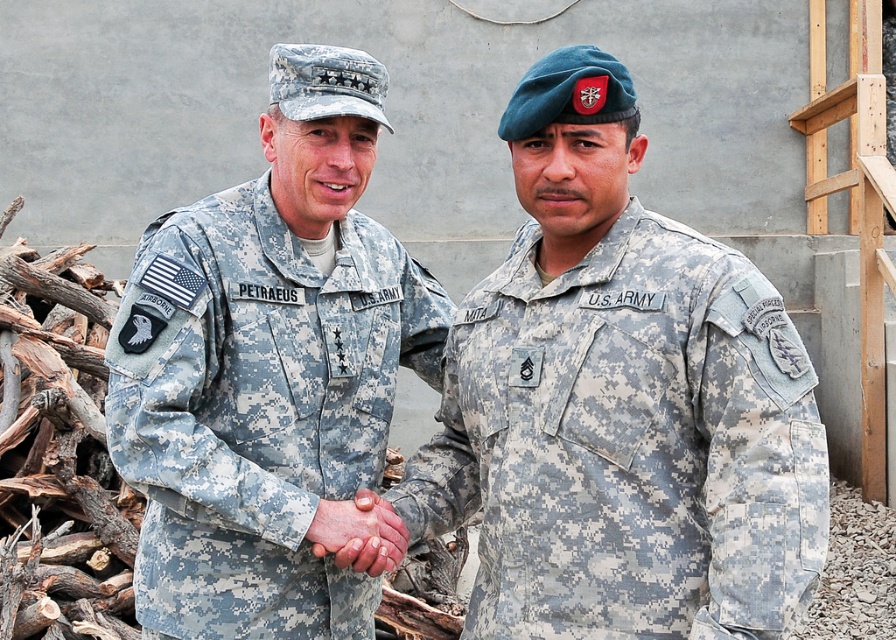
You are a photographer taking a picture of the scene. You want to focus on the point closer to the camera. Which point should you choose between point [610,566] and point [145,392]?

Point [610,566] is closer to the camera than point [145,392], so you should choose point [610,566] to focus on.

You are a photographer setting up for a military photo shoot. You need to position two models wearing the camouflage fabric us army uniform at center and the camouflage fabric uniform at left. Based on the scene description, which model should stand closer to the camera to ensure both appear equally wide in the photo?

The camouflage fabric uniform at left is narrower than the camouflage fabric us army uniform at center. To make them appear equally wide in the photo, the narrower camouflage fabric uniform at left should be positioned closer to the camera.